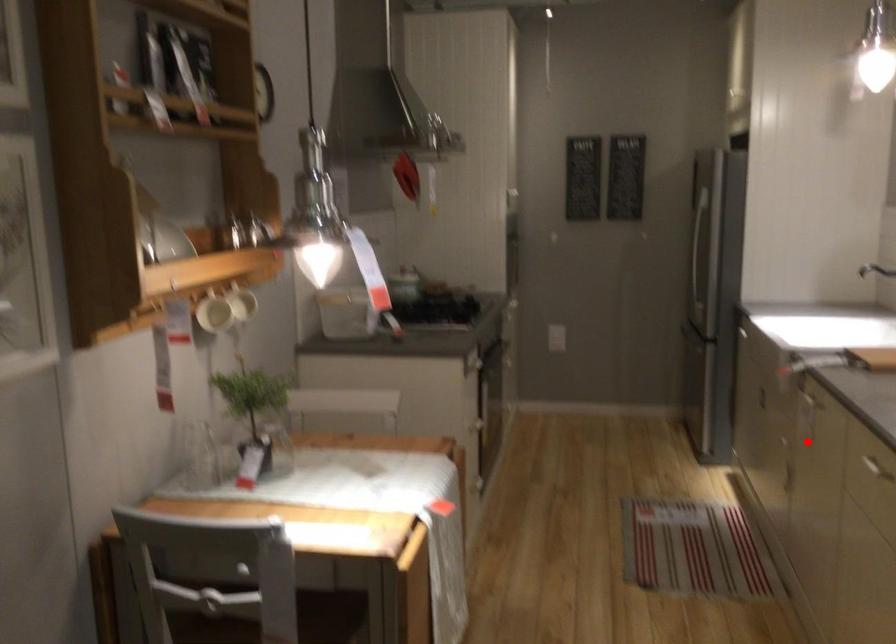
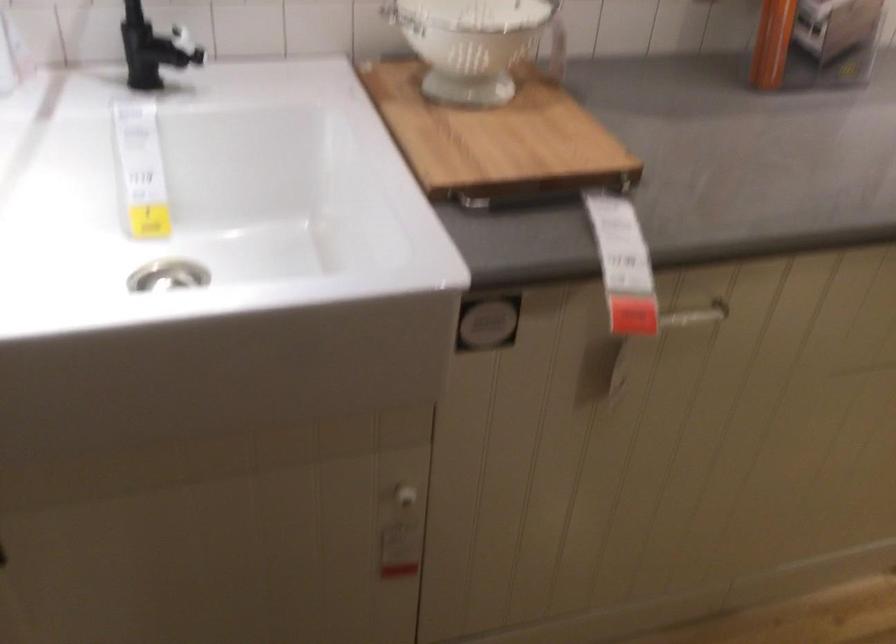
Question: I am providing you with two images of the same scene from different viewpoints. Image1 has a red point marked. In image2, the corresponding 3D location appears at what relative position? Reply with the corresponding letter.

Choices:
 (A) Closer
 (B) Farther

Answer: (A)